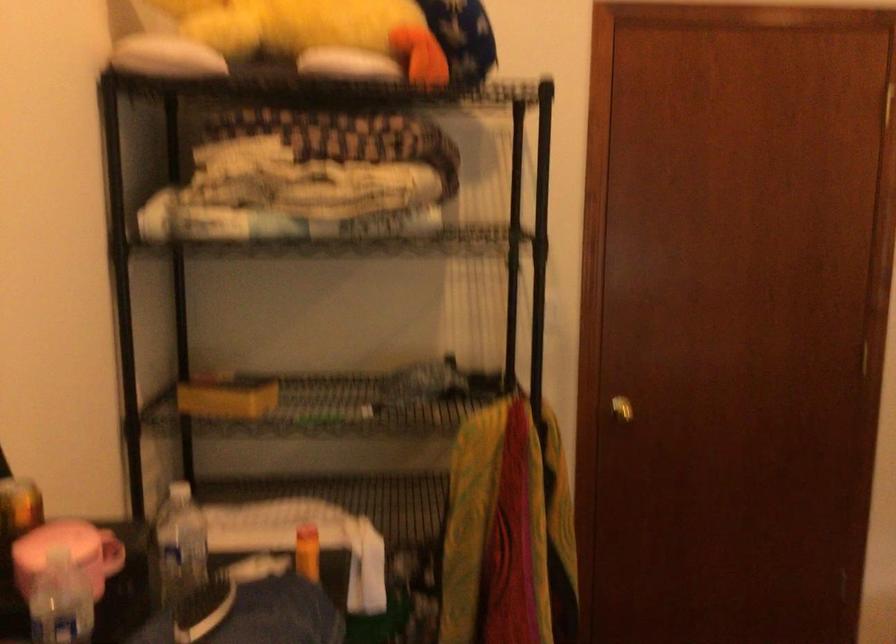
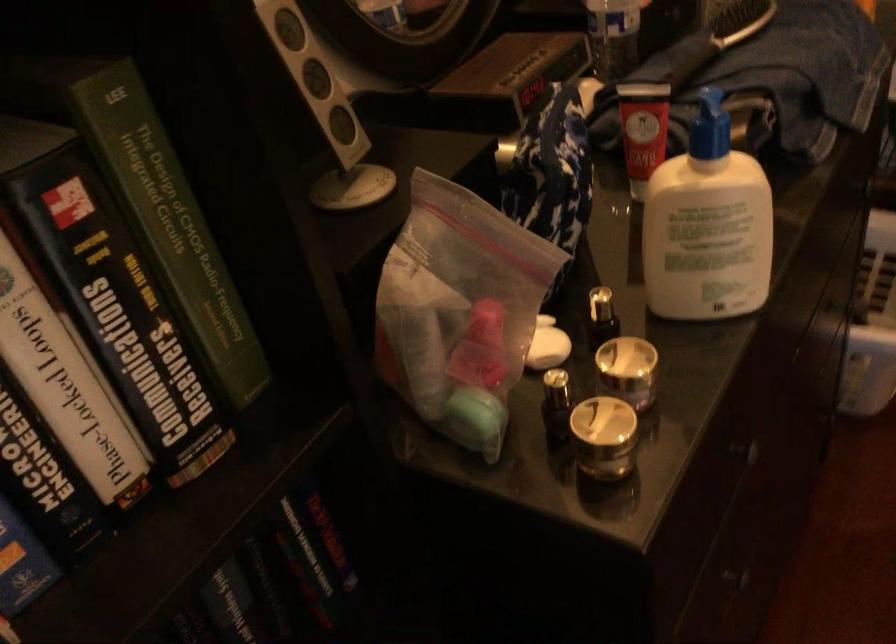
Based on the continuous images, in which direction is the camera rotating?

The rotation direction of the camera is left-down.